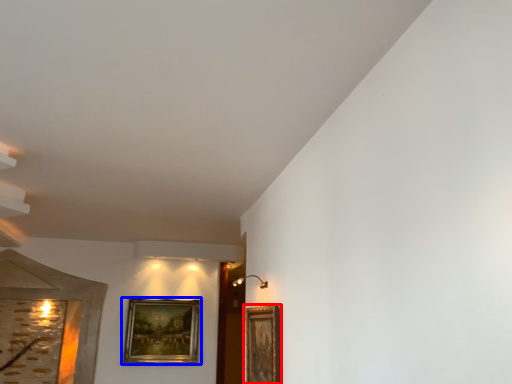
Question: Which point is closer to the camera, picture frame (highlighted by a red box) or picture frame (highlighted by a blue box)?

Choices:
 (A) picture frame
 (B) picture frame

Answer: (A)